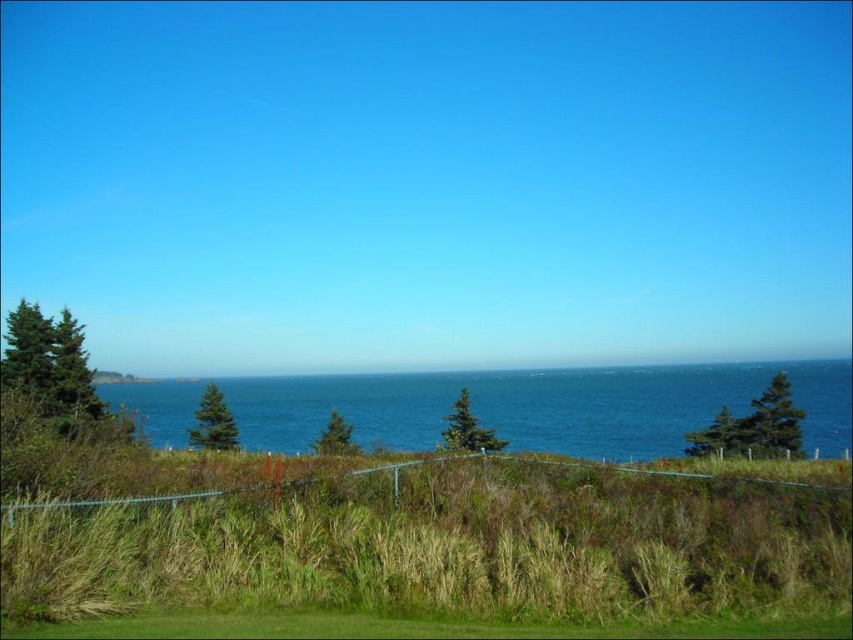
Is green grassy at lower center closer to the viewer compared to blue water at center?

That is True.

Measure the distance from green grassy at lower center to blue water at center.

A distance of 95.84 meters exists between green grassy at lower center and blue water at center.

Locate an element on the screen. The width and height of the screenshot is (853, 640). green grassy at lower center is located at coordinates (444, 545).